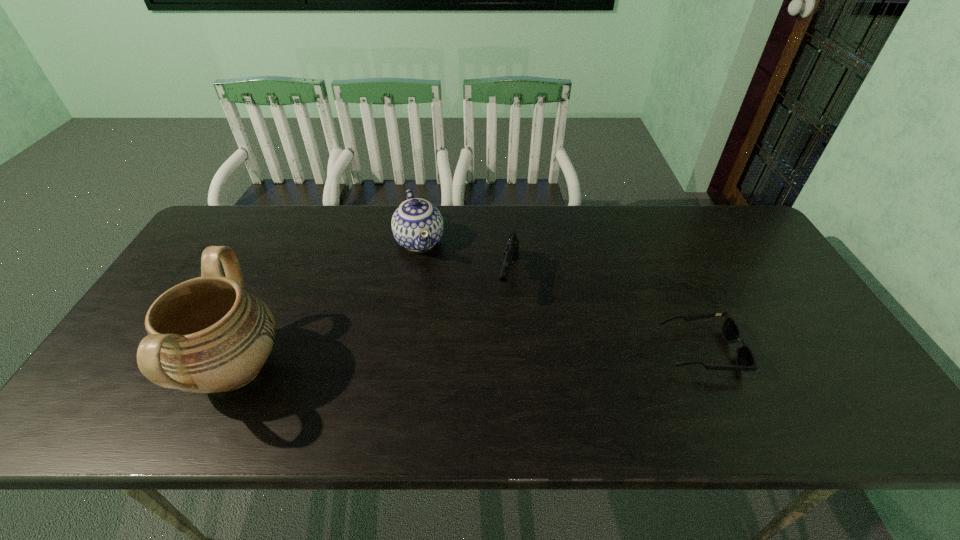
This screenshot has width=960, height=540. In order to click on free space between the urn and the third object from right to left in this screenshot , I will do `click(327, 305)`.

Where is `vacant space that is in between the urn and the second tallest object`? The width and height of the screenshot is (960, 540). vacant space that is in between the urn and the second tallest object is located at coordinates (327, 305).

Image resolution: width=960 pixels, height=540 pixels. Identify the location of free spot between the leftmost object and the shortest object. (468, 360).

Locate an element on the screen. free spot between the third object from right to left and the third tallest object is located at coordinates (465, 259).

You are a GUI agent. You are given a task and a screenshot of the screen. Output one action in this format:
    pyautogui.click(x=<x>, y=<y>)
    Task: Click on the vacant point located between the leftmost object and the third shortest object
    
    Given the screenshot: What is the action you would take?
    tap(327, 305)

The width and height of the screenshot is (960, 540). I want to click on object that is the third closest to the shortest object, so click(x=205, y=335).

Find the location of a particular element. This screenshot has width=960, height=540. object that ranks as the closest to the second shortest object is located at coordinates (417, 225).

Where is `free location that satisfies the following two spatial constraints: 1. on the front side of the sunglasses; 2. on the front-facing side of the third object from right to left`? This screenshot has width=960, height=540. free location that satisfies the following two spatial constraints: 1. on the front side of the sunglasses; 2. on the front-facing side of the third object from right to left is located at coordinates (402, 350).

Where is `free location that satisfies the following two spatial constraints: 1. on the front side of the second shortest object; 2. on the front-facing side of the sunglasses`? The height and width of the screenshot is (540, 960). free location that satisfies the following two spatial constraints: 1. on the front side of the second shortest object; 2. on the front-facing side of the sunglasses is located at coordinates click(x=514, y=350).